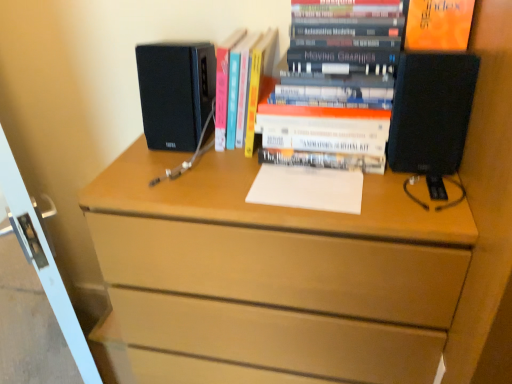
Find the location of a particular element. The width and height of the screenshot is (512, 384). vacant region below white paper at center (from a real-world perspective) is located at coordinates (300, 183).